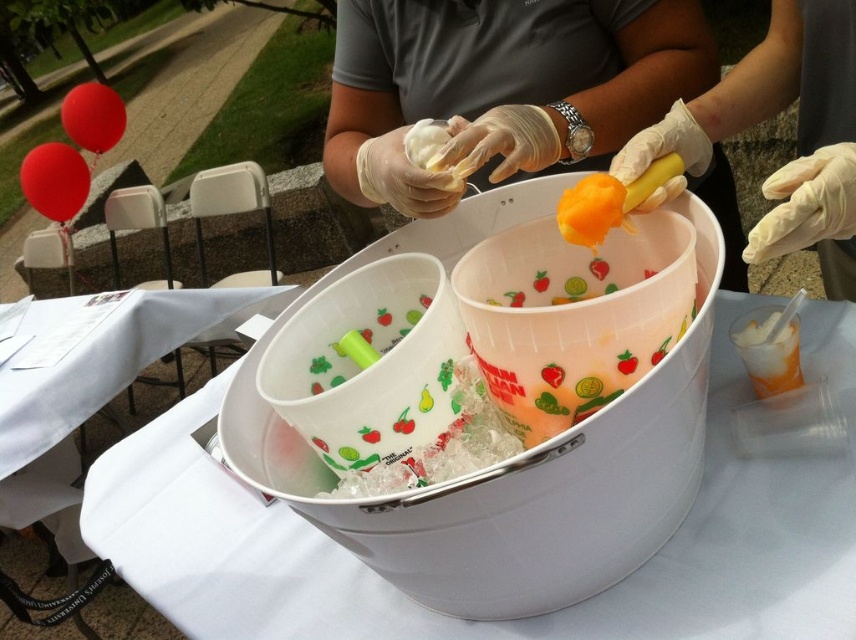
Question: Which point is farther from the camera taking this photo?

Choices:
 (A) (531, 108)
 (B) (645, 467)

Answer: (A)

Question: Is white plastic bucket at center smaller than white latex gloves at upper right?

Choices:
 (A) no
 (B) yes

Answer: (A)

Question: Estimate the real-world distances between objects in this image. Which object is closer to the orange gelatinous substance at center?

Choices:
 (A) white latex gloves at upper right
 (B) yellow rubbery substance at center
 (C) matte white gloves at upper center
 (D) white plastic bucket at center

Answer: (B)

Question: Which object is closer to the camera taking this photo?

Choices:
 (A) matte white gloves at upper center
 (B) yellow rubbery substance at center
 (C) orange gelatinous substance at center
 (D) white plastic bucket at center

Answer: (D)

Question: Can you confirm if matte white gloves at upper center is smaller than yellow rubbery substance at center?

Choices:
 (A) yes
 (B) no

Answer: (B)

Question: Does matte white gloves at upper center appear on the left side of orange gelatinous substance at center?

Choices:
 (A) yes
 (B) no

Answer: (B)